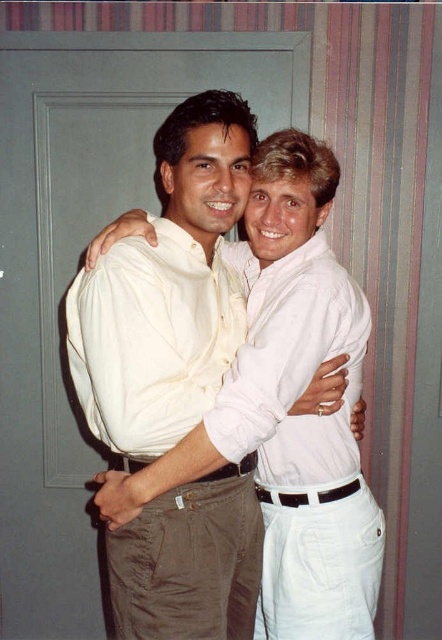
You are trying to decide which white shirt to wear for an event. You see both the white cotton shirt at center and the white matte shirt at center in the image. Which one is positioned to the left?

The white cotton shirt at center is positioned to the left of the white matte shirt at center.

You are trying to decide which shirt to wear for a casual day out. Both the white cotton shirt at center and the white matte shirt at center are options. Based on their sizes, which one would you choose if you prefer a looser fit?

The white cotton shirt at center has a larger width than the white matte shirt at center, so it would provide a looser fit and be the better choice for a casual day out.